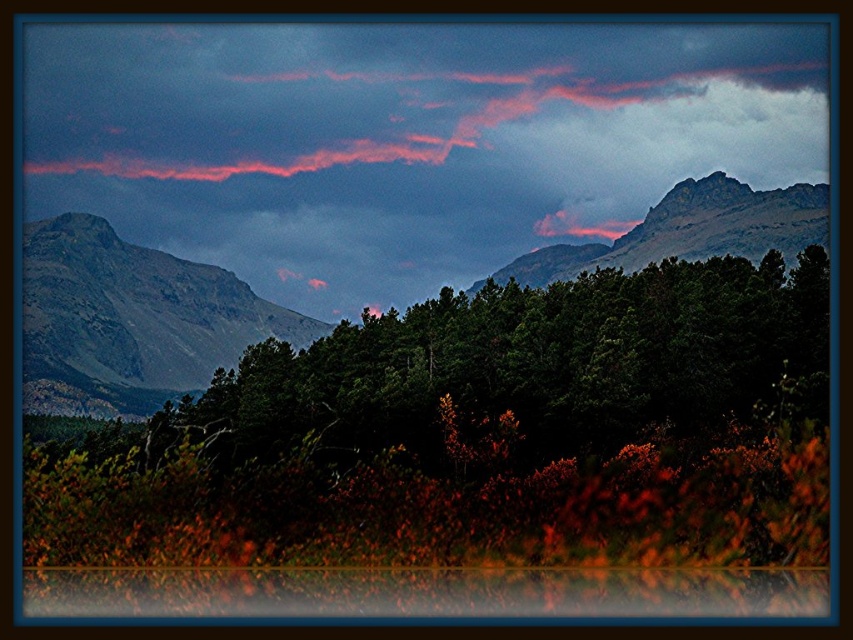
You are an artist planning to paint the scene. You want to ensure the green matte tree at center and rugged stone mountain at left are proportionally accurate. Which object should you make wider in your painting?

The green matte tree at center should be made wider in the painting since its width is larger than the rugged stone mountain at left according to the description.

You are an environmental scientist analyzing this landscape. You need to determine which area covers more horizontal space in the image between the green textured forest at center and the rugged stone mountain at left. Based on the scene, which one is wider?

The green textured forest at center is wider than the rugged stone mountain at left because its width surpasses the mountain.

You are standing in the landscape scene and want to take a photo of both the green textured forest at center and the rugged stone mountain at left. Which object will appear larger in the photo due to its height?

The green textured forest at center will appear larger in the photo because it is much taller than the rugged stone mountain at left.